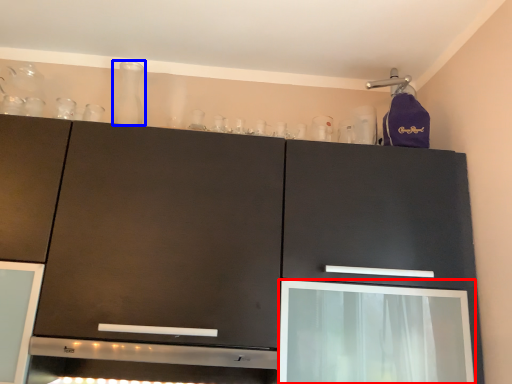
Question: Which object appears closest to the camera in this image, screen door (highlighted by a red box) or glass vase (highlighted by a blue box)?

Choices:
 (A) screen door
 (B) glass vase

Answer: (A)